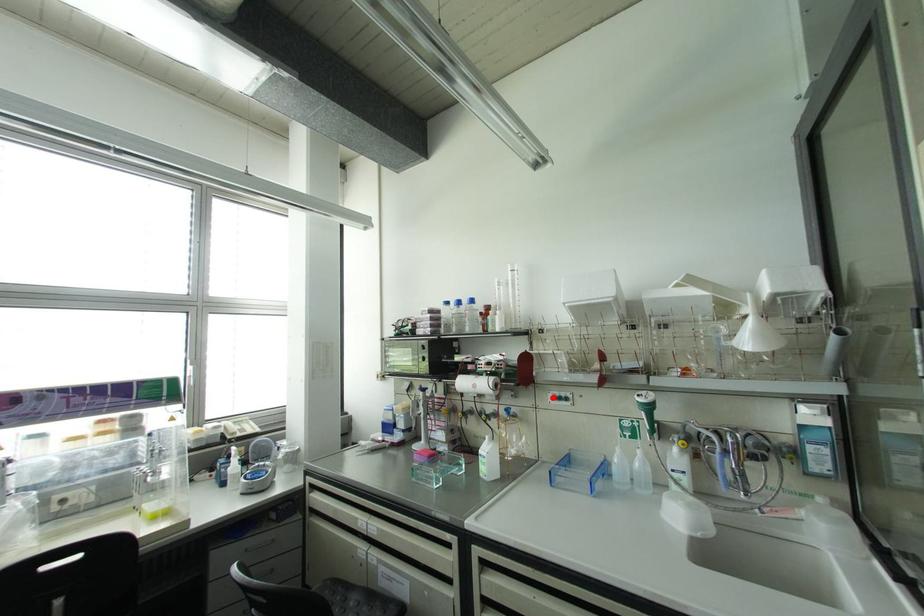
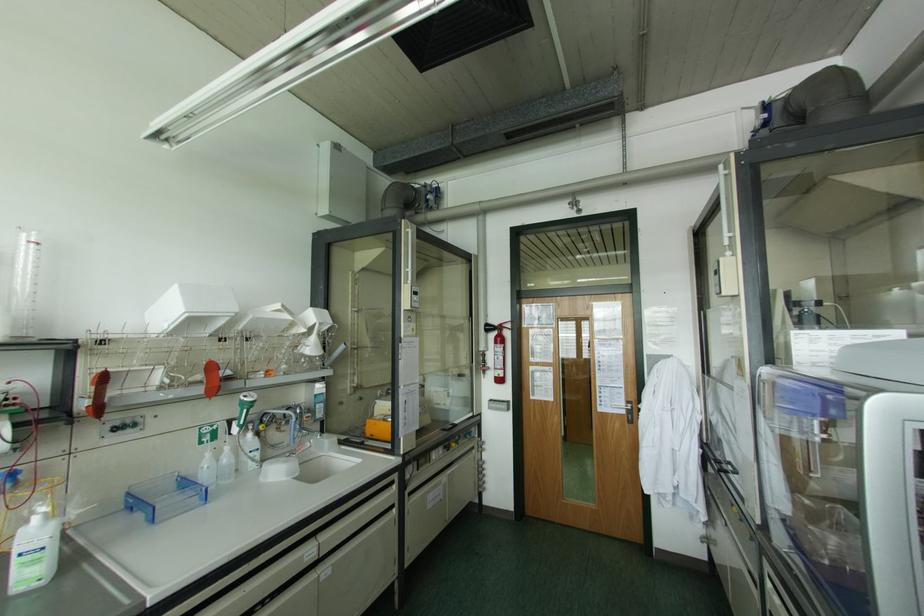
The point at the highlighted location is marked in the first image. Where is the corresponding point in the second image?

(115, 428)